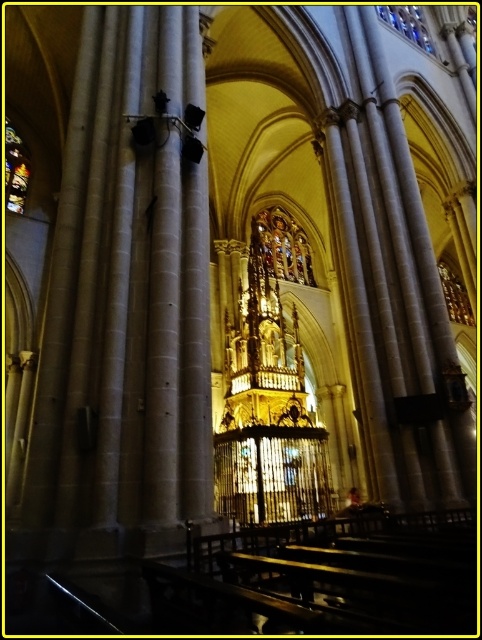
You are standing in the cathedral and notice two stained glass windows. One is the stained glass window at upper left and the other is the stained glass window at upper center. Which of these two stained glass windows is positioned higher up in the cathedral?

The stained glass window at upper center is positioned higher up in the cathedral than the stained glass window at upper left.